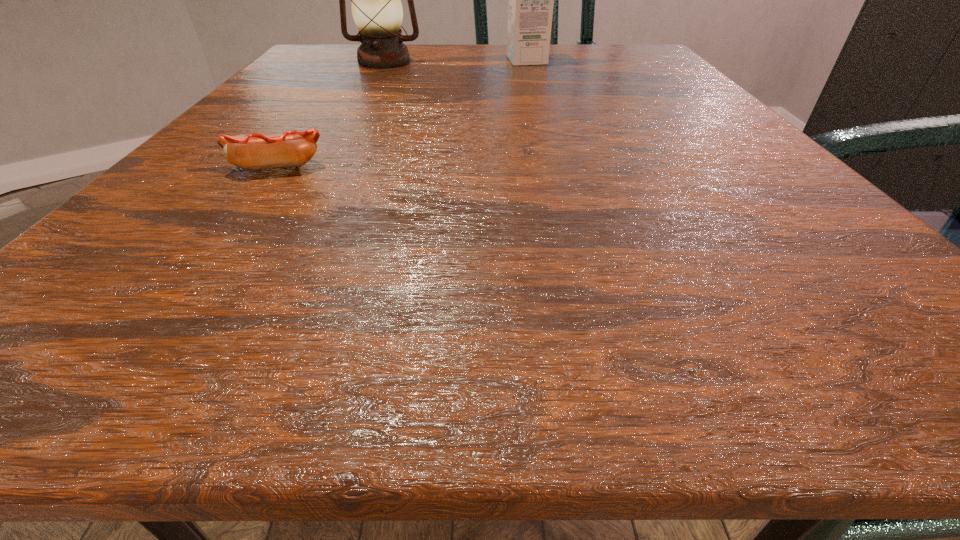
The width and height of the screenshot is (960, 540). In order to click on free space between the tallest object and the rightmost object in this screenshot , I will do `click(455, 61)`.

This screenshot has height=540, width=960. I want to click on free space that is in between the sausage and the tallest object, so click(x=331, y=114).

Image resolution: width=960 pixels, height=540 pixels. What are the coordinates of `vacant area that lies between the tallest object and the sausage` in the screenshot? It's located at point(331,114).

At what (x,y) coordinates should I click in order to perform the action: click on vacant space that's between the tallest object and the sausage. Please return your answer as a coordinate pair (x, y). Looking at the image, I should click on (331, 114).

Locate an element on the screen. The height and width of the screenshot is (540, 960). free spot between the oil lamp and the carton is located at coordinates (455, 61).

The height and width of the screenshot is (540, 960). Find the location of `vacant point located between the carton and the shortest object`. vacant point located between the carton and the shortest object is located at coordinates [402, 114].

Locate an element on the screen. This screenshot has height=540, width=960. unoccupied area between the nearest object and the tallest object is located at coordinates (331, 114).

This screenshot has height=540, width=960. Identify the location of empty location between the rightmost object and the oil lamp. (455, 61).

At what (x,y) coordinates should I click in order to perform the action: click on free space between the tallest object and the rightmost object. Please return your answer as a coordinate pair (x, y). Looking at the image, I should click on (x=455, y=61).

Identify the location of object that stands as the closest to the oil lamp. (530, 9).